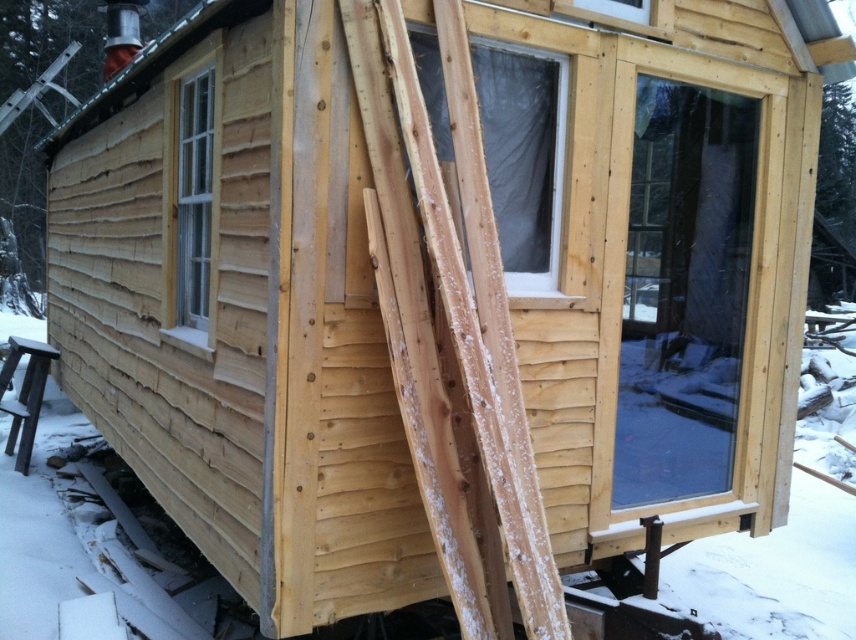
You are a contractor assessing the construction site. You have a delivery of materials that includes a large sheet of glass and a smaller sheet of plastic. You need to install the largest sheet possible in the transparent glass door at right and the clear plastic window at center. Which material should be placed in each location?

The transparent glass door at right has a larger size compared to the clear plastic window at center. Therefore, the large sheet of glass should be installed in the transparent glass door at right, and the smaller sheet of plastic should be placed in the clear plastic window at center.

You are a contractor checking the windows of the small wooden structure. You notice two windows, the clear plastic window at center and the clear glass window at left. Which window is closer to you?

The clear plastic window at center is closer to you because it is in front of the clear glass window at left.

You are standing in front of the cabin and want to enter through the transparent glass door at right. Where should you walk to reach it?

You should walk towards the transparent glass door at right located at point (x=682, y=291) to reach it.